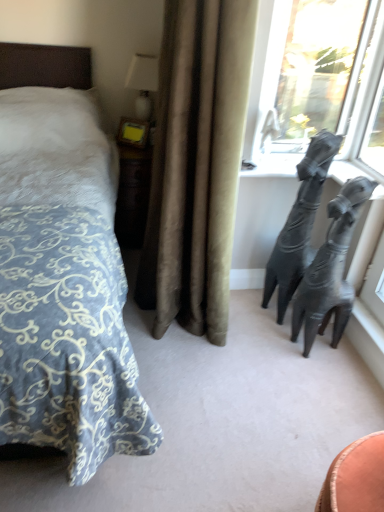
Question: Is shiny metallic sculpture at right wider or thinner than blue patterned fabric bed at left?

Choices:
 (A) wide
 (B) thin

Answer: (B)

Question: Is shiny metallic sculpture at right spatially inside blue patterned fabric bed at left, or outside of it?

Choices:
 (A) inside
 (B) outside

Answer: (B)

Question: Which of these objects is positioned farthest from the transparent glass window at upper right?

Choices:
 (A) velvet beige curtain at center
 (B) white glossy table lamp at upper center
 (C) shiny metallic sculpture at right
 (D) black matte giraffe at right
 (E) blue patterned fabric bed at left

Answer: (E)

Question: Which is farther from the shiny metallic sculpture at right?

Choices:
 (A) transparent glass window at upper right
 (B) white glossy table lamp at upper center
 (C) velvet beige curtain at center
 (D) blue patterned fabric bed at left
 (E) black matte giraffe at right

Answer: (B)